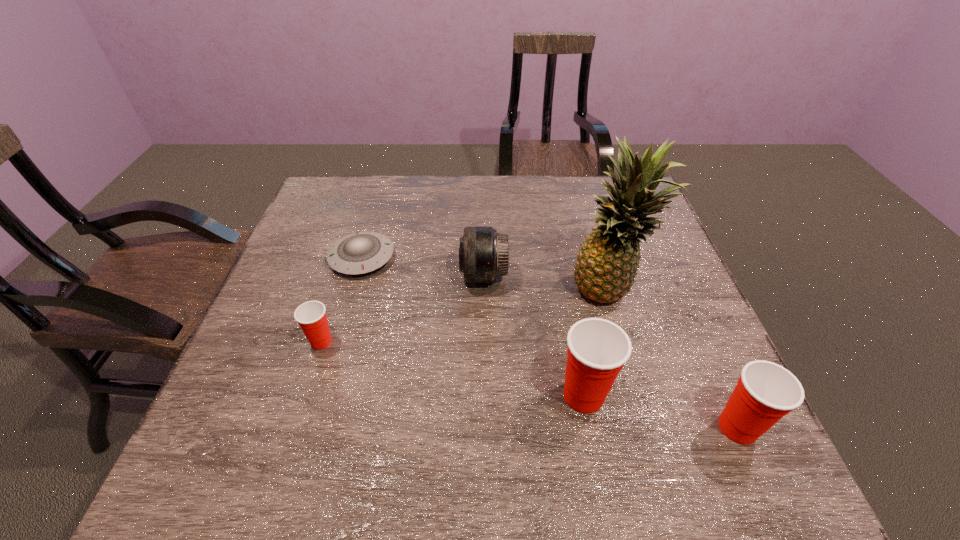
You are a GUI agent. You are given a task and a screenshot of the screen. Output one action in this format:
    pyautogui.click(x=<x>, y=<y>)
    Task: Click on the shortest Dixie cup
    
    Given the screenshot: What is the action you would take?
    pyautogui.click(x=311, y=316)

Where is `the third nearest object`? the third nearest object is located at coordinates (311, 316).

This screenshot has height=540, width=960. I want to click on the second Dixie cup from left to right, so click(597, 350).

At what (x,y) coordinates should I click in order to perform the action: click on the second shortest Dixie cup. Please return your answer as a coordinate pair (x, y). The image size is (960, 540). Looking at the image, I should click on (765, 392).

Identify the location of the rightmost Dixie cup. (765, 392).

At what (x,y) coordinates should I click in order to perform the action: click on pineapple. Please return your answer as a coordinate pair (x, y). This screenshot has width=960, height=540. Looking at the image, I should click on (607, 263).

Where is `the shortest object`? This screenshot has height=540, width=960. the shortest object is located at coordinates (361, 252).

Locate an element on the screen. The height and width of the screenshot is (540, 960). telephoto lens is located at coordinates (483, 253).

Find the location of a particular element. vacant region located on the back of the leftmost Dixie cup is located at coordinates (345, 268).

What are the coordinates of `vacant area situated 0.290m on the left of the second Dixie cup from right to left` in the screenshot? It's located at (412, 396).